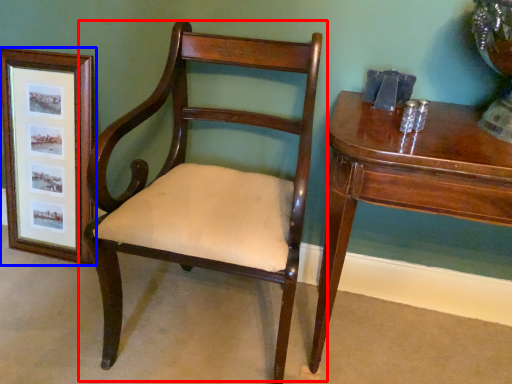
Question: Which object is further to the camera taking this photo, chair (highlighted by a red box) or picture frame (highlighted by a blue box)?

Choices:
 (A) chair
 (B) picture frame

Answer: (B)